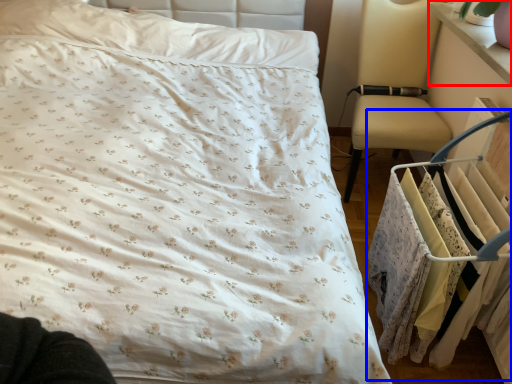
Question: Which point is further to the camera, changing table (highlighted by a red box) or closet (highlighted by a blue box)?

Choices:
 (A) changing table
 (B) closet

Answer: (A)